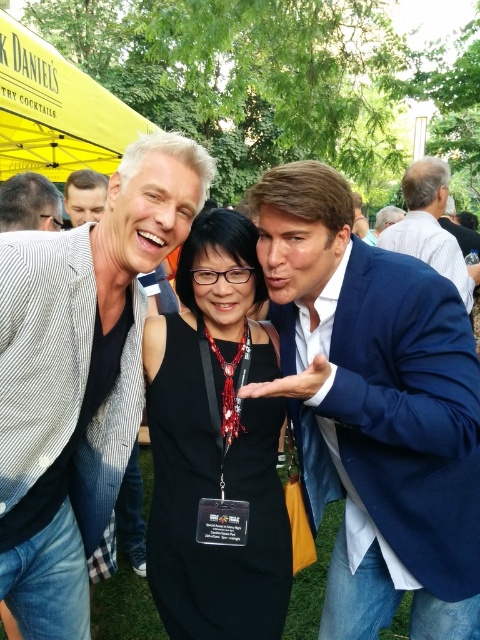
You are a photographer at the event and need to adjust the lighting to accommodate the suits. Since the blue satin suit at center reflects more light than the matte black suit at center, which suit requires more careful lighting adjustments to avoid overexposure?

The blue satin suit at center requires more careful lighting adjustments because it reflects more light and has a larger width than the matte black suit at center, making it more prone to overexposure.

You are at a park event and see the black satin dress at center and the matte black shirt at left. Which one is positioned more to the right side?

The black satin dress at center is positioned more to the right side than the matte black shirt at left.